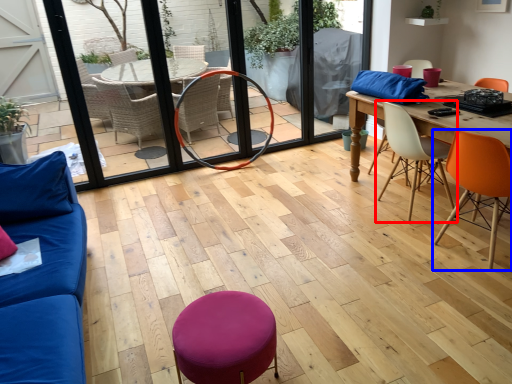
Question: Which object is further to the camera taking this photo, chair (highlighted by a red box) or chair (highlighted by a blue box)?

Choices:
 (A) chair
 (B) chair

Answer: (A)